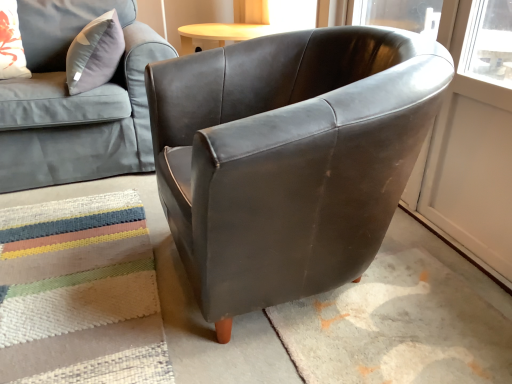
What do you see at coordinates (76, 100) in the screenshot? I see `matte gray fabric couch at upper left` at bounding box center [76, 100].

Identify the location of matte brown leather armchair at center. This screenshot has width=512, height=384. (288, 157).

Find the location of a particular element. This screenshot has width=512, height=384. floral fabric pillow at upper left is located at coordinates (11, 43).

Does floral fabric pillow at upper left appear on the left side of matte gray fabric couch at upper left?

Yes, floral fabric pillow at upper left is to the left of matte gray fabric couch at upper left.

From the image's perspective, which object appears higher, floral fabric pillow at upper left or matte gray fabric couch at upper left?

floral fabric pillow at upper left appears higher in the image.

Is floral fabric pillow at upper left not close to matte gray fabric couch at upper left?

No.

Considering the positions of point (9, 73) and point (68, 37), is point (9, 73) closer or farther from the camera than point (68, 37)?

Point (9, 73) is closer to the camera than point (68, 37).

Considering the sizes of objects matte gray fabric couch at upper left and floral fabric pillow at upper left in the image provided, who is thinner, matte gray fabric couch at upper left or floral fabric pillow at upper left?

floral fabric pillow at upper left.

From the image's perspective, would you say matte gray fabric couch at upper left is shown under floral fabric pillow at upper left?

Result: Correct, matte gray fabric couch at upper left appears lower than floral fabric pillow at upper left in the image.

Is matte gray fabric couch at upper left to the left of floral fabric pillow at upper left from the viewer's perspective?

Incorrect, matte gray fabric couch at upper left is not on the left side of floral fabric pillow at upper left.

Which is farther from the camera, (56, 48) or (18, 49)?

The point (56, 48) is farther from the camera.

Can you confirm if matte gray fabric couch at upper left is thinner than textured woven mat at lower left?

Indeed, matte gray fabric couch at upper left has a lesser width compared to textured woven mat at lower left.

Is matte gray fabric couch at upper left far away from textured woven mat at lower left?

That's not correct — matte gray fabric couch at upper left is a little close to textured woven mat at lower left.

Would you say matte gray fabric couch at upper left is outside textured woven mat at lower left?

That's correct, matte gray fabric couch at upper left is outside of textured woven mat at lower left.

Looking at this image, measure the distance from matte gray fabric couch at upper left to textured woven mat at lower left.

They are 27.03 inches apart.

This screenshot has width=512, height=384. I want to click on chair that is below the floral fabric pillow at upper left (from the image's perspective), so click(x=288, y=157).

Considering the sizes of floral fabric pillow at upper left and matte brown leather armchair at center in the image, is floral fabric pillow at upper left wider or thinner than matte brown leather armchair at center?

Considering their sizes, floral fabric pillow at upper left looks slimmer than matte brown leather armchair at center.

Is floral fabric pillow at upper left completely or partially outside of matte brown leather armchair at center?

Yes, floral fabric pillow at upper left is not within matte brown leather armchair at center.

Which is more to the right, floral fabric pillow at upper left or matte brown leather armchair at center?

matte brown leather armchair at center.

From the image's perspective, which is below, matte brown leather armchair at center or floral fabric pillow at upper left?

From the image's view, matte brown leather armchair at center is below.

From a real-world perspective, is matte brown leather armchair at center positioned above or below floral fabric pillow at upper left?

matte brown leather armchair at center is below floral fabric pillow at upper left.

From the picture: Does matte brown leather armchair at center have a larger size compared to floral fabric pillow at upper left?

Yes, matte brown leather armchair at center is bigger than floral fabric pillow at upper left.

Which is more to the left, matte brown leather armchair at center or floral fabric pillow at upper left?

floral fabric pillow at upper left.

Consider the image. Would you say textured woven mat at lower left is inside or outside floral fabric pillow at upper left?

textured woven mat at lower left exists outside the volume of floral fabric pillow at upper left.

Relative to floral fabric pillow at upper left, is textured woven mat at lower left in front or behind?

textured woven mat at lower left is positioned closer to the viewer than floral fabric pillow at upper left.

In order to click on pillow above the textured woven mat at lower left (from a real-world perspective) in this screenshot , I will do `click(11, 43)`.

Is textured woven mat at lower left taller than floral fabric pillow at upper left?

Incorrect, the height of textured woven mat at lower left is not larger of that of floral fabric pillow at upper left.

From a real-world perspective, is floral fabric pillow at upper left located beneath textured woven mat at lower left?

No, from a real-world perspective, floral fabric pillow at upper left is not under textured woven mat at lower left.

Is floral fabric pillow at upper left outside of textured woven mat at lower left?

Yes, floral fabric pillow at upper left is located beyond the bounds of textured woven mat at lower left.

Can you confirm if floral fabric pillow at upper left is thinner than textured woven mat at lower left?

Correct, the width of floral fabric pillow at upper left is less than that of textured woven mat at lower left.

Can you tell me how much floral fabric pillow at upper left and textured woven mat at lower left differ in facing direction?

The angular difference between floral fabric pillow at upper left and textured woven mat at lower left is 178 degrees.

The image size is (512, 384). Identify the location of pillow above the matte gray fabric couch at upper left (from a real-world perspective). (11, 43).

This screenshot has width=512, height=384. Find the location of `pillow behind the matte gray fabric couch at upper left`. pillow behind the matte gray fabric couch at upper left is located at coordinates (11, 43).

When comparing their distances from floral fabric pillow at upper left, does textured woven mat at lower left or matte gray fabric couch at upper left seem closer?

Among the two, matte gray fabric couch at upper left is located nearer to floral fabric pillow at upper left.

From the image, which object appears to be nearer to matte brown leather armchair at center, matte gray fabric couch at upper left or textured woven mat at lower left?

textured woven mat at lower left.

Estimate the real-world distances between objects in this image. Which object is further from floral fabric pillow at upper left, textured woven mat at lower left or matte brown leather armchair at center?

The object further to floral fabric pillow at upper left is matte brown leather armchair at center.

Estimate the real-world distances between objects in this image. Which object is closer to matte gray fabric couch at upper left, floral fabric pillow at upper left or matte brown leather armchair at center?

The object closer to matte gray fabric couch at upper left is floral fabric pillow at upper left.

When comparing their distances from floral fabric pillow at upper left, does matte brown leather armchair at center or matte gray fabric couch at upper left seem closer?

The object closer to floral fabric pillow at upper left is matte gray fabric couch at upper left.

When comparing their distances from textured woven mat at lower left, does matte gray fabric couch at upper left or matte brown leather armchair at center seem further?

Among the two, matte gray fabric couch at upper left is located further to textured woven mat at lower left.

Based on their spatial positions, is matte gray fabric couch at upper left or textured woven mat at lower left closer to floral fabric pillow at upper left?

matte gray fabric couch at upper left lies closer to floral fabric pillow at upper left than the other object.

Looking at the image, which one is located closer to matte brown leather armchair at center, textured woven mat at lower left or floral fabric pillow at upper left?

textured woven mat at lower left is positioned closer to the anchor matte brown leather armchair at center.

In order to click on mat situated between floral fabric pillow at upper left and matte brown leather armchair at center from left to right in this screenshot , I will do `click(80, 294)`.

This screenshot has height=384, width=512. Find the location of `studio couch between floral fabric pillow at upper left and textured woven mat at lower left from top to bottom`. studio couch between floral fabric pillow at upper left and textured woven mat at lower left from top to bottom is located at coordinates (76, 100).

Where is `studio couch between floral fabric pillow at upper left and matte brown leather armchair at center from left to right`? studio couch between floral fabric pillow at upper left and matte brown leather armchair at center from left to right is located at coordinates (76, 100).

You are a GUI agent. You are given a task and a screenshot of the screen. Output one action in this format:
    pyautogui.click(x=<x>, y=<y>)
    Task: Click on the mat between matte gray fabric couch at upper left and matte brown leather armchair at center from left to right
    Image resolution: width=512 pixels, height=384 pixels.
    Given the screenshot: What is the action you would take?
    pyautogui.click(x=80, y=294)